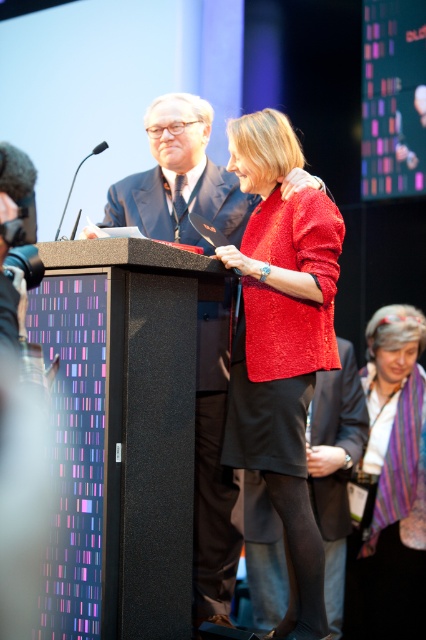
Question: Which of the following is the closest to the observer?

Choices:
 (A) matte black suit at center
 (B) black matte business suit at center

Answer: (A)

Question: Which of the following is the farthest from the observer?

Choices:
 (A) black matte business suit at center
 (B) shiny red jacket at center

Answer: (A)

Question: Is shiny red jacket at center bigger than matte black suit at center?

Choices:
 (A) no
 (B) yes

Answer: (A)

Question: Does shiny red jacket at center have a greater width compared to black matte business suit at center?

Choices:
 (A) yes
 (B) no

Answer: (B)

Question: Which of these objects is positioned farthest from the multicolored woven scarf at lower right?

Choices:
 (A) black matte business suit at center
 (B) matte black suit at center

Answer: (B)

Question: Does shiny red jacket at center have a greater width compared to multicolored woven scarf at lower right?

Choices:
 (A) no
 (B) yes

Answer: (A)